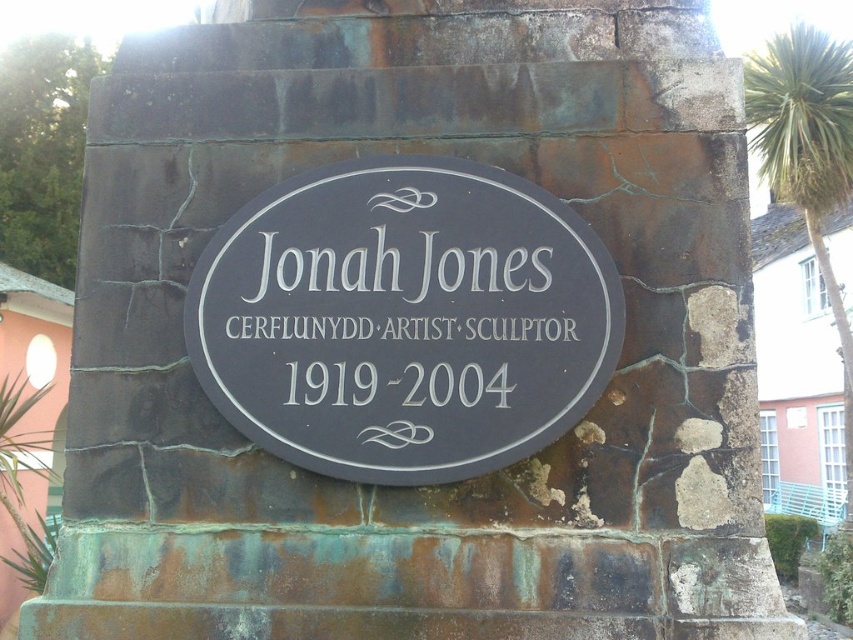
Question: Which point is farther from the camera taking this photo?

Choices:
 (A) (772, 131)
 (B) (253, 304)

Answer: (A)

Question: Does matte black plaque at center appear over green leafy palm tree at upper right?

Choices:
 (A) no
 (B) yes

Answer: (A)

Question: Which of these objects is positioned closest to the black polished stone plaque at center?

Choices:
 (A) matte black plaque at center
 (B) green leafy palm tree at upper right

Answer: (A)

Question: Which object appears closest to the camera in this image?

Choices:
 (A) matte black plaque at center
 (B) green leafy palm tree at upper right

Answer: (A)

Question: Does black polished stone plaque at center have a smaller size compared to green leafy palm tree at upper right?

Choices:
 (A) no
 (B) yes

Answer: (B)

Question: Does black polished stone plaque at center lie behind matte black plaque at center?

Choices:
 (A) no
 (B) yes

Answer: (A)